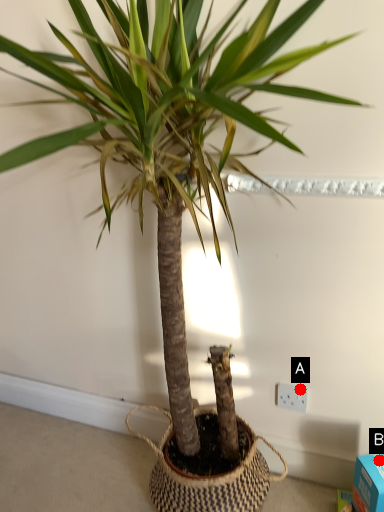
Question: Two points are circled on the image, labeled by A and B beside each circle. Which of the following is the farthest from the observer?

Choices:
 (A) A is further
 (B) B is further

Answer: (A)